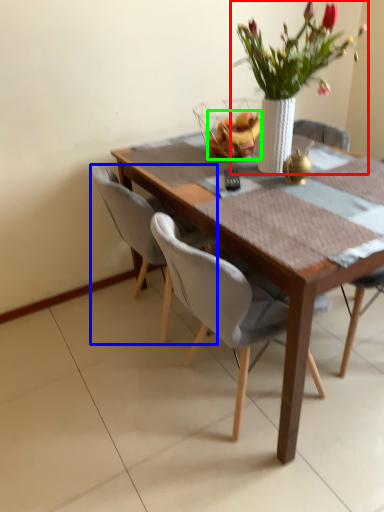
Question: Which object is the closest to the houseplant (highlighted by a red box)? Choose among these: chair (highlighted by a blue box) or fruit (highlighted by a green box).

Choices:
 (A) chair
 (B) fruit

Answer: (B)